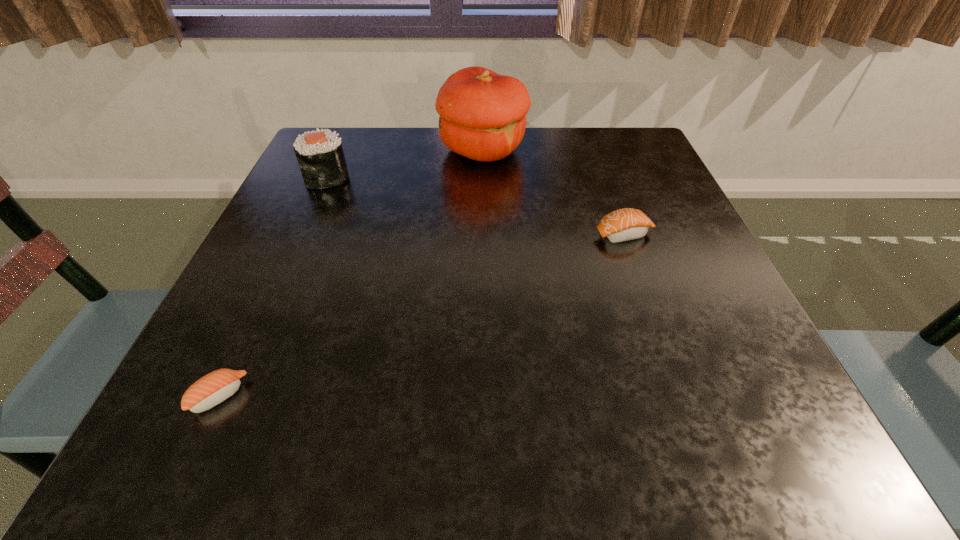
Locate an element on the screen. The image size is (960, 540). the second object from right to left is located at coordinates (482, 114).

Locate an element on the screen. the tallest object is located at coordinates (482, 114).

Identify the location of the tallest sushi. The width and height of the screenshot is (960, 540). (320, 156).

This screenshot has width=960, height=540. Identify the location of the farthest sushi. (320, 156).

Locate an element on the screen. The width and height of the screenshot is (960, 540). the second nearest object is located at coordinates click(625, 224).

Where is `the second nearest sushi`? the second nearest sushi is located at coordinates (625, 224).

At what (x,y) coordinates should I click in order to perform the action: click on the nearest sushi. Please return your answer as a coordinate pair (x, y). The image size is (960, 540). Looking at the image, I should click on (212, 389).

I want to click on free location located on the left of the tallest object, so click(x=377, y=150).

At what (x,y) coordinates should I click in order to perform the action: click on free spot located 0.140m on the right of the farthest sushi. Please return your answer as a coordinate pair (x, y). Image resolution: width=960 pixels, height=540 pixels. Looking at the image, I should click on (413, 177).

At what (x,y) coordinates should I click in order to perform the action: click on vacant space located 0.200m on the back of the third farthest object. Please return your answer as a coordinate pair (x, y). Looking at the image, I should click on (601, 170).